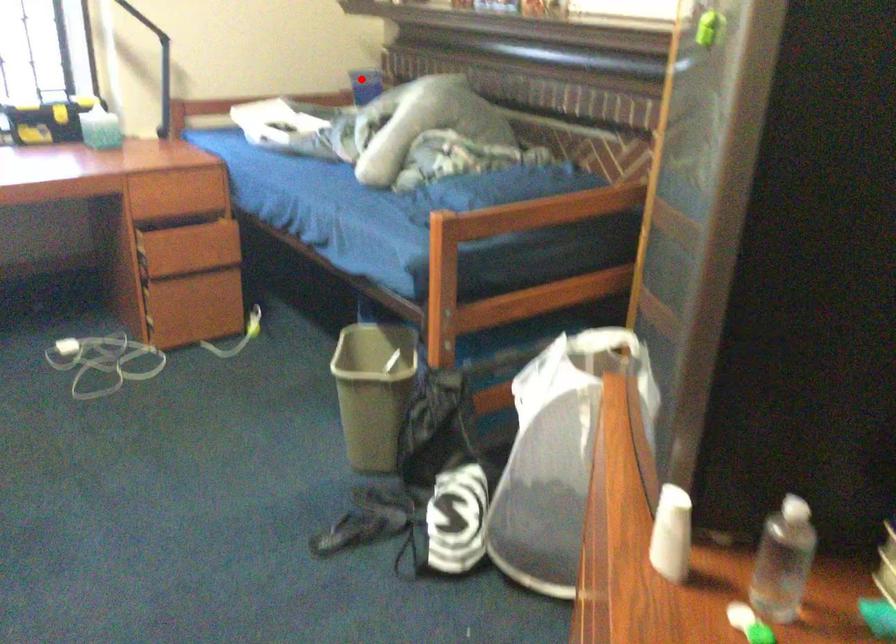
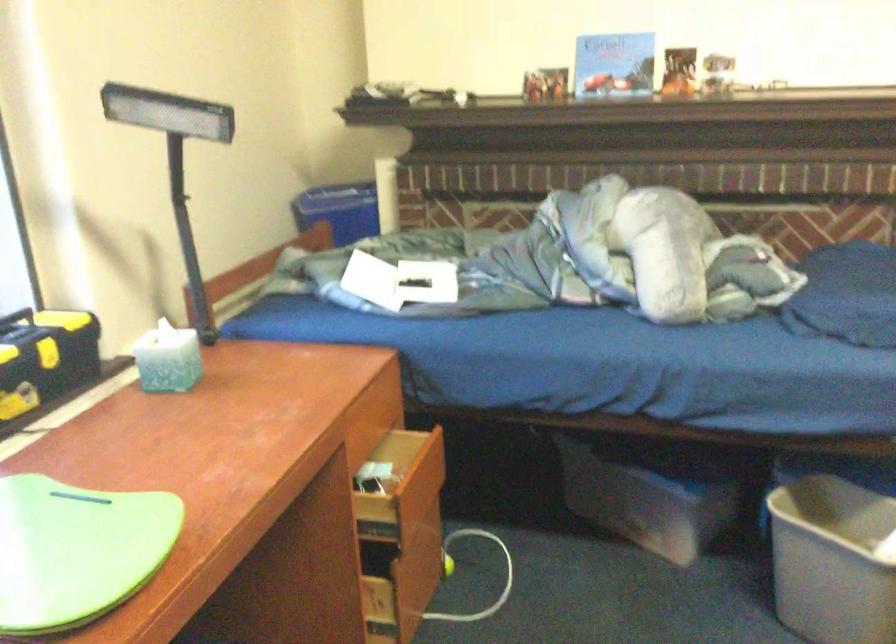
Question: A red point is marked in image1. In image2, is the corresponding 3D point closer to the camera or farther? Reply with the corresponding letter.

Choices:
 (A) The corresponding 3D point is closer.
 (B) The corresponding 3D point is farther.

Answer: (A)